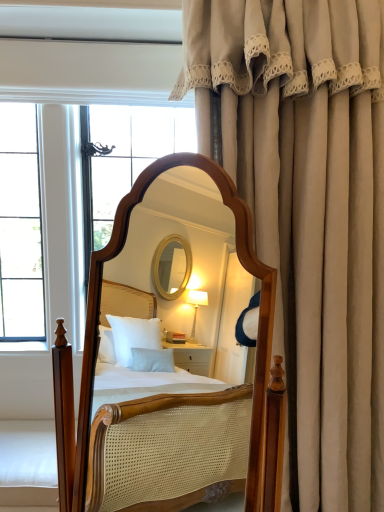
What do you see at coordinates (309, 214) in the screenshot? I see `beige fabric curtain at right` at bounding box center [309, 214].

The height and width of the screenshot is (512, 384). In order to click on beige fabric curtain at right in this screenshot , I will do `click(309, 214)`.

Find the location of a particular element. The height and width of the screenshot is (512, 384). beige fabric curtain at right is located at coordinates (309, 214).